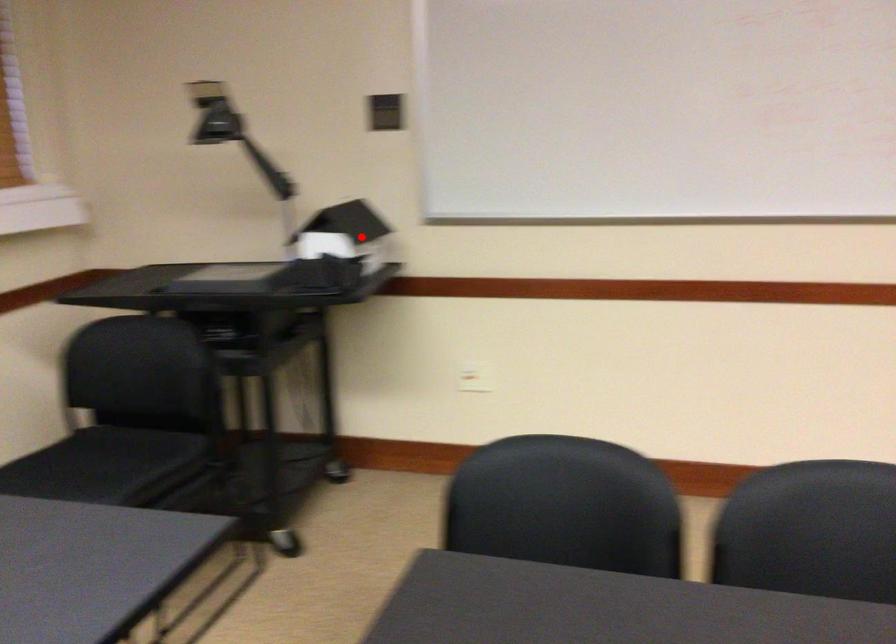
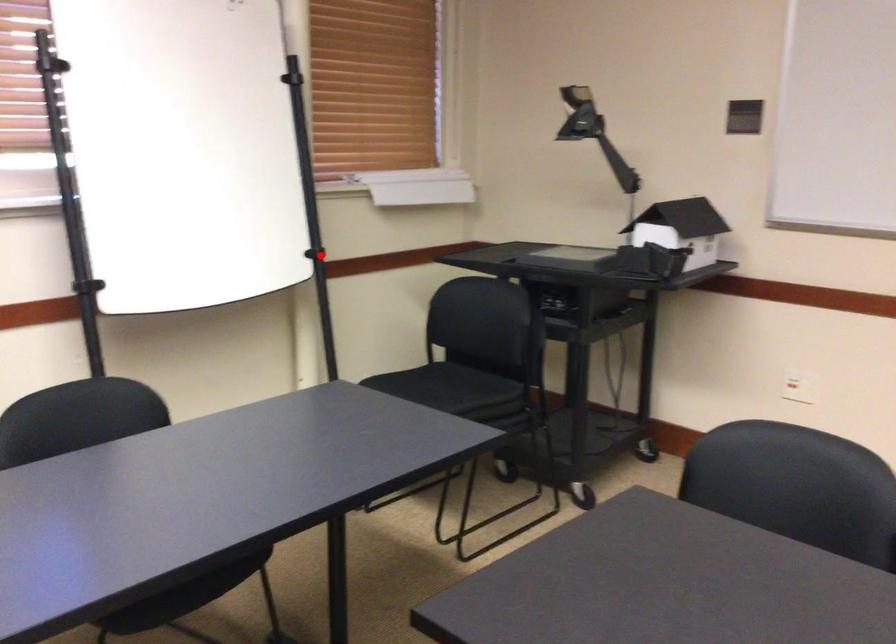
I am providing you with two images of the same scene from different viewpoints. A red point is marked on the first image and another point is marked on the second image. Is the red point in image1 aligned with the point shown in image2?

No